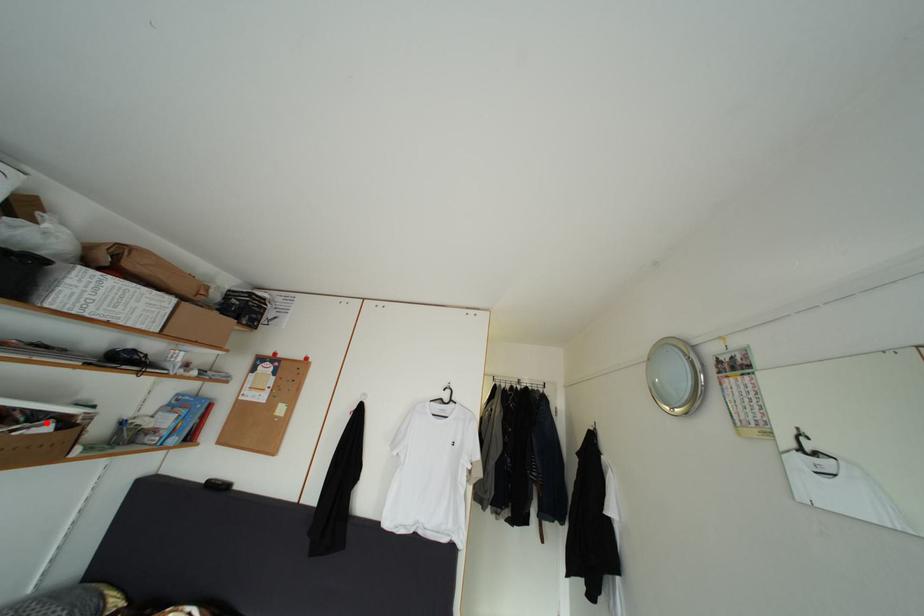
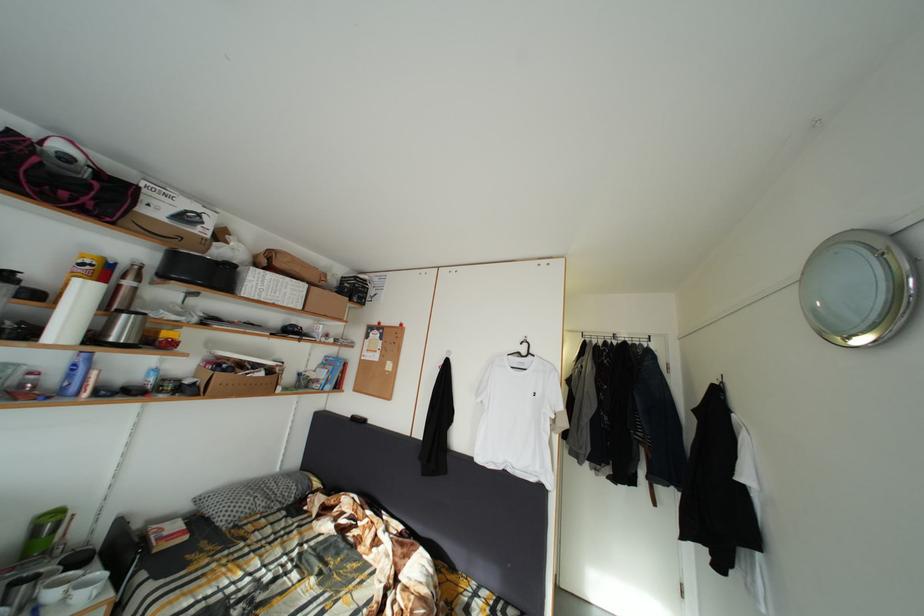
Question: I am providing you with two images of the same scene from different viewpoints. Given a red point in image1, look at the same physical point in image2. Is it:

Choices:
 (A) Closer to the viewpoint
 (B) Farther from the viewpoint

Answer: (B)